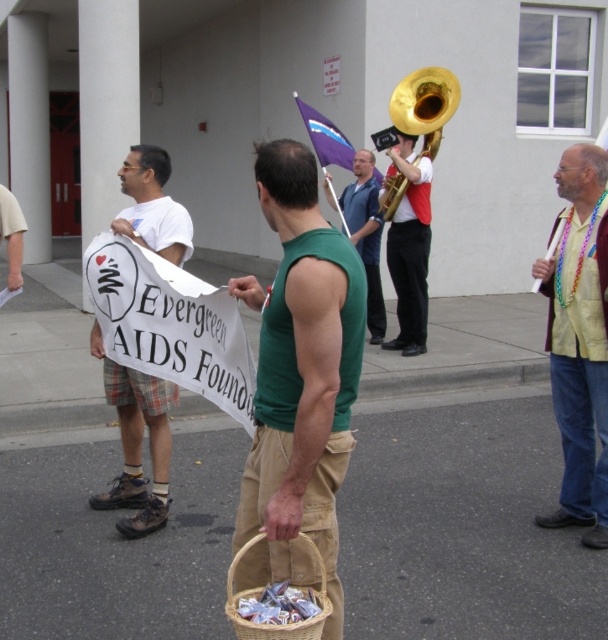
Question: Where is khakimaterial/texture at center located in relation to woven brown basket at lower center in the image?

Choices:
 (A) left
 (B) right

Answer: (A)

Question: Which object is the closest to the white cotton t-shirt at left?

Choices:
 (A) multicolored beaded necklace at right
 (B) khakimaterial/texture at center

Answer: (B)

Question: Does khakimaterial/texture at center lie in front of gold shiny tuba at upper right?

Choices:
 (A) no
 (B) yes

Answer: (B)

Question: Among these objects, which one is nearest to the camera?

Choices:
 (A) multicolored beaded necklace at right
 (B) khakimaterial/texture at center
 (C) woven brown basket at lower center

Answer: (C)

Question: Among these objects, which one is nearest to the camera?

Choices:
 (A) white cotton t-shirt at left
 (B) khakimaterial/texture at center
 (C) blue denim shirt at center

Answer: (B)

Question: Does white cotton t-shirt at left appear on the right side of khaki shorts at lower left?

Choices:
 (A) yes
 (B) no

Answer: (A)